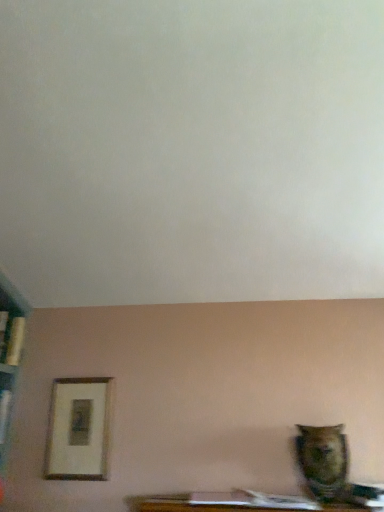
Question: Is wooden framed print at lower left oriented away from matte brown owl at lower right?

Choices:
 (A) yes
 (B) no

Answer: (B)

Question: Is the depth of wooden framed print at lower left greater than that of matte brown owl at lower right?

Choices:
 (A) no
 (B) yes

Answer: (B)

Question: Is wooden framed print at lower left bigger than matte brown owl at lower right?

Choices:
 (A) yes
 (B) no

Answer: (B)

Question: Is wooden framed print at lower left smaller than matte brown owl at lower right?

Choices:
 (A) no
 (B) yes

Answer: (B)

Question: From a real-world perspective, is wooden framed print at lower left located higher than matte brown owl at lower right?

Choices:
 (A) yes
 (B) no

Answer: (A)

Question: Is wooden framed print at lower left thinner than matte brown owl at lower right?

Choices:
 (A) yes
 (B) no

Answer: (A)

Question: Can you confirm if matte brown owl at lower right is smaller than wooden framed print at lower left?

Choices:
 (A) no
 (B) yes

Answer: (A)

Question: Is matte brown owl at lower right completely or partially outside of wooden framed print at lower left?

Choices:
 (A) yes
 (B) no

Answer: (A)

Question: Is matte brown owl at lower right at the right side of wooden framed print at lower left?

Choices:
 (A) yes
 (B) no

Answer: (A)

Question: Does matte brown owl at lower right appear on the left side of wooden framed print at lower left?

Choices:
 (A) yes
 (B) no

Answer: (B)

Question: Is matte brown owl at lower right next to wooden framed print at lower left and touching it?

Choices:
 (A) yes
 (B) no

Answer: (B)

Question: Is wooden framed print at lower left at the back of matte brown owl at lower right?

Choices:
 (A) yes
 (B) no

Answer: (B)

Question: Considering the relative positions of matte brown owl at lower right and wooden framed print at lower left in the image provided, is matte brown owl at lower right to the left or to the right of wooden framed print at lower left?

Choices:
 (A) right
 (B) left

Answer: (A)